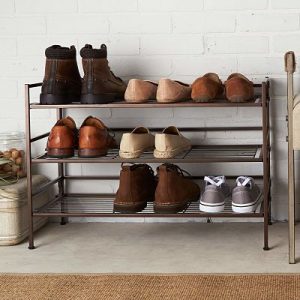
At what (x,y) coordinates should I click in order to perform the action: click on top shelf. Please return your answer as a coordinate pair (x, y). Image resolution: width=300 pixels, height=300 pixels. Looking at the image, I should click on coord(64,76), coord(109,83), coord(144,91), coord(174,91), coord(209,89), coord(238,91).